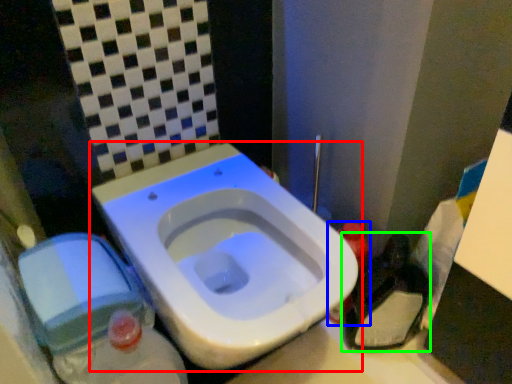
Question: Which object is positioned closest to toilet (highlighted by a red box)? Select from bottle (highlighted by a blue box) and garbage (highlighted by a green box).

Choices:
 (A) bottle
 (B) garbage

Answer: (A)